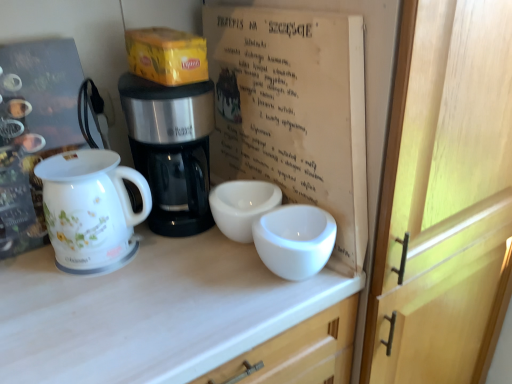
Question: Considering the positions of yellow cardboard box at upper center and white paper at center in the image, is yellow cardboard box at upper center wider or thinner than white paper at center?

Choices:
 (A) wide
 (B) thin

Answer: (A)

Question: Considering the positions of yellow cardboard box at upper center and white paper at center in the image, is yellow cardboard box at upper center taller or shorter than white paper at center?

Choices:
 (A) short
 (B) tall

Answer: (A)

Question: Which object is positioned closest to the white glossy jug at left?

Choices:
 (A) white paper at center
 (B) yellow cardboard box at upper center
 (C) black plastic coffee maker at center

Answer: (C)

Question: Estimate the real-world distances between objects in this image. Which object is farther from the white glossy jug at left?

Choices:
 (A) white paper at center
 (B) yellow cardboard box at upper center
 (C) black plastic coffee maker at center

Answer: (A)